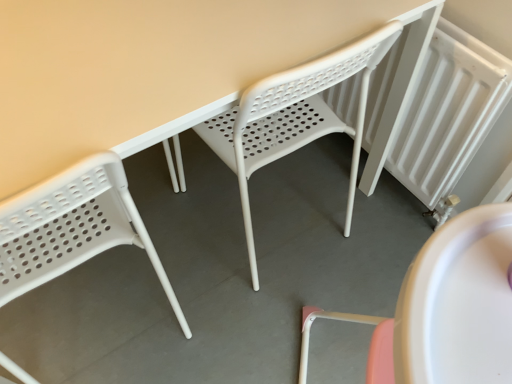
Find the location of a particular element. vacant area that is in front of white plastic chair at center, which appears as the 1th chair when viewed from the right is located at coordinates (260, 312).